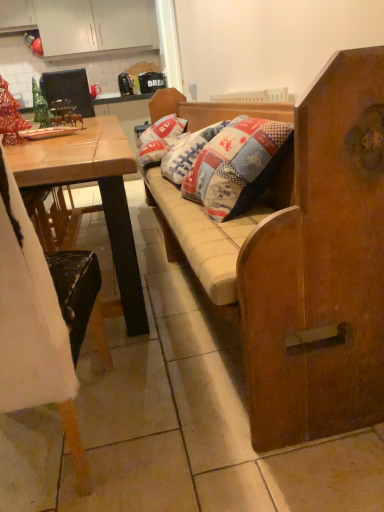
Question: Relative to wooden chair at left, is metallic green ornament at upper left in front or behind?

Choices:
 (A) front
 (B) behind

Answer: (B)

Question: From the image's perspective, is metallic green ornament at upper left located above or below wooden chair at left?

Choices:
 (A) above
 (B) below

Answer: (A)

Question: Estimate the real-world distances between objects in this image. Which object is closer to the wooden chair at left?

Choices:
 (A) metallic black armchair at upper left
 (B) white matte cabinet at upper left
 (C) metallic green ornament at upper left
 (D) wooden desk at left
 (E) wooden cushioned bench at center

Answer: (E)

Question: Based on their relative distances, which object is nearer to the white matte cabinet at upper left?

Choices:
 (A) wooden cushioned bench at center
 (B) wooden chair at left
 (C) metallic green ornament at upper left
 (D) metallic black armchair at upper left
 (E) wooden desk at left

Answer: (D)